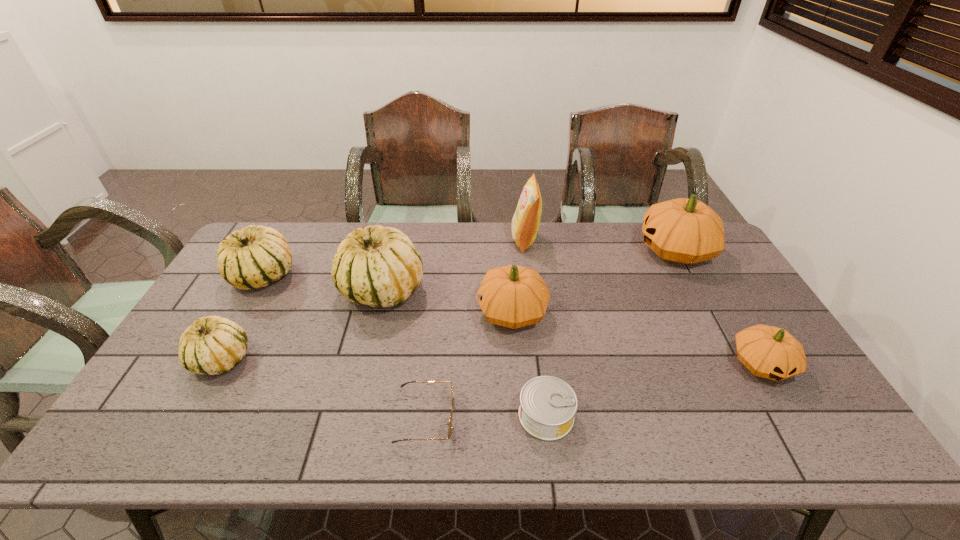
What are the coordinates of `free space between the third gourd from left to right and the nearest white gourd` in the screenshot? It's located at (301, 325).

Find the location of a particular element. The width and height of the screenshot is (960, 540). blank region between the nearest orange gourd and the rightmost white gourd is located at coordinates (572, 327).

Locate an element on the screen. This screenshot has height=540, width=960. vacant space in between the smallest orange gourd and the second nearest orange gourd is located at coordinates (636, 338).

Identify the location of free space between the silver can and the leftmost orange gourd. (529, 363).

Select which object is the closest to the farthest orange gourd. Please provide its 2D coordinates. Your answer should be formatted as a tuple, i.e. [(x, y)], where the tuple contains the x and y coordinates of a point satisfying the conditions above.

[(770, 352)]

Locate an element on the screen. The height and width of the screenshot is (540, 960). object that is the third closest to the smallest white gourd is located at coordinates (451, 413).

Identify which gourd is the second closest to the biggest white gourd. Please provide its 2D coordinates. Your answer should be formatted as a tuple, i.e. [(x, y)], where the tuple contains the x and y coordinates of a point satisfying the conditions above.

[(513, 296)]

Locate which gourd is the second closest to the nearest orange gourd. Please provide its 2D coordinates. Your answer should be formatted as a tuple, i.e. [(x, y)], where the tuple contains the x and y coordinates of a point satisfying the conditions above.

[(513, 296)]

Identify which orange gourd is the second nearest to the second smallest white gourd. Please provide its 2D coordinates. Your answer should be formatted as a tuple, i.e. [(x, y)], where the tuple contains the x and y coordinates of a point satisfying the conditions above.

[(686, 231)]

Where is `the second closest orange gourd to the farthest orange gourd`? Image resolution: width=960 pixels, height=540 pixels. the second closest orange gourd to the farthest orange gourd is located at coordinates (513, 296).